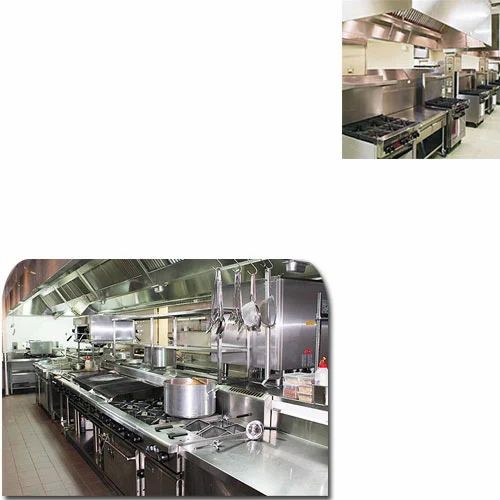
Locate an element on the screen. This screenshot has width=500, height=500. floors is located at coordinates (54, 455), (482, 139).